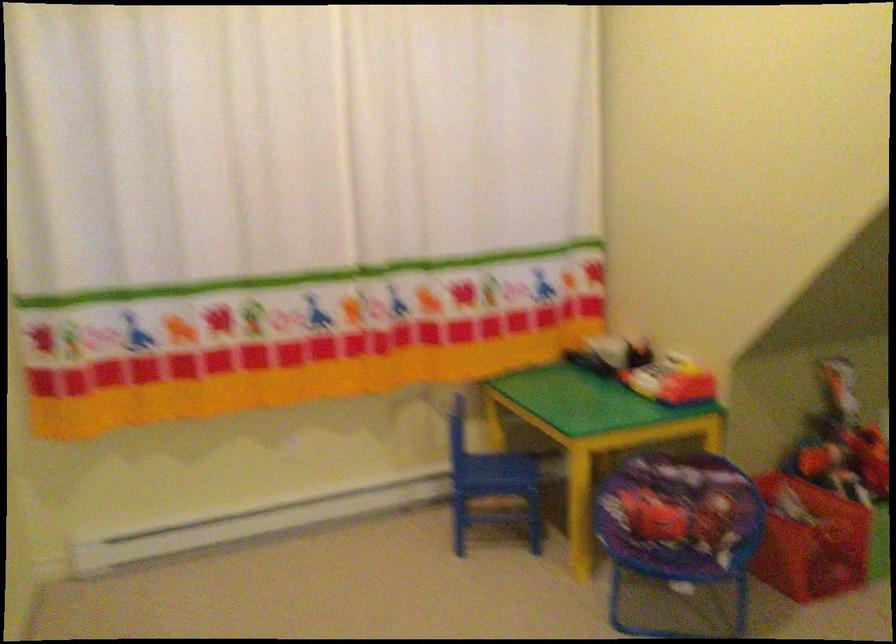
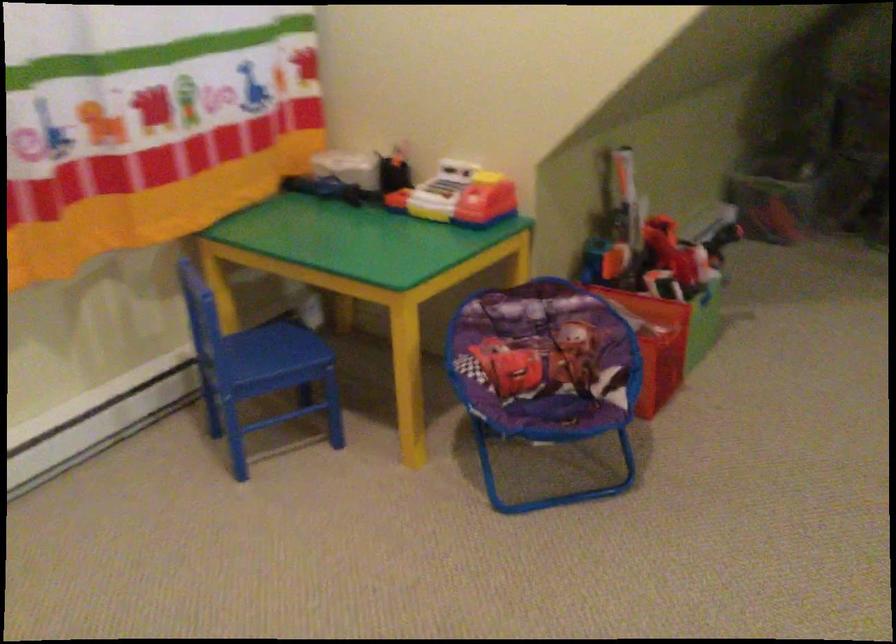
Where in the second image is the point corresponding to [811,538] from the first image?

(653, 343)